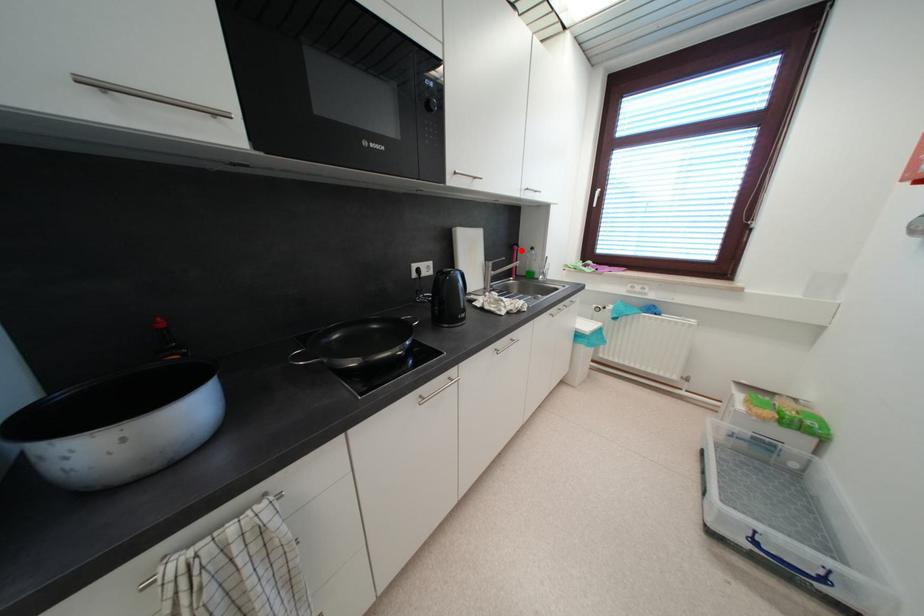
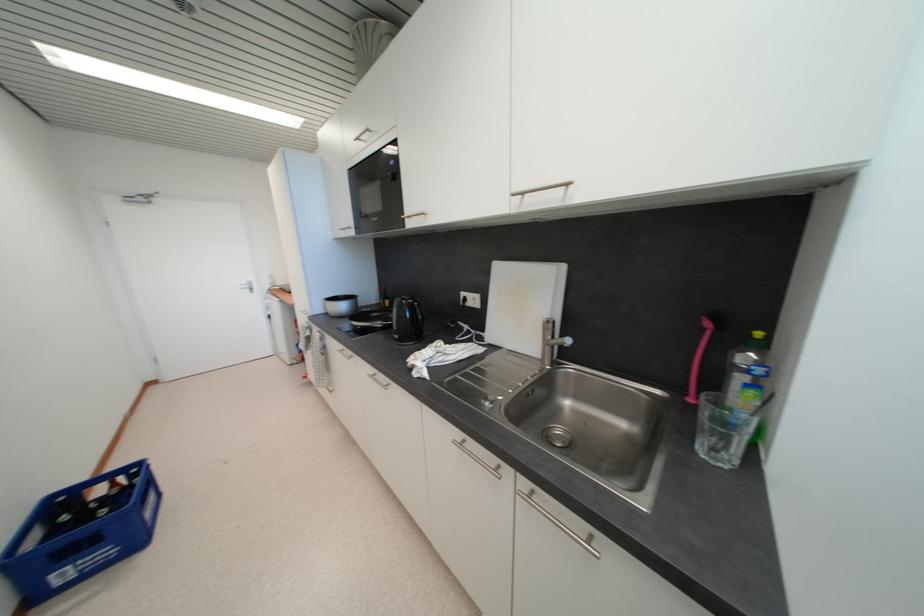
Where in the second image is the point corresponding to the highlighted location from the first image?

(713, 326)